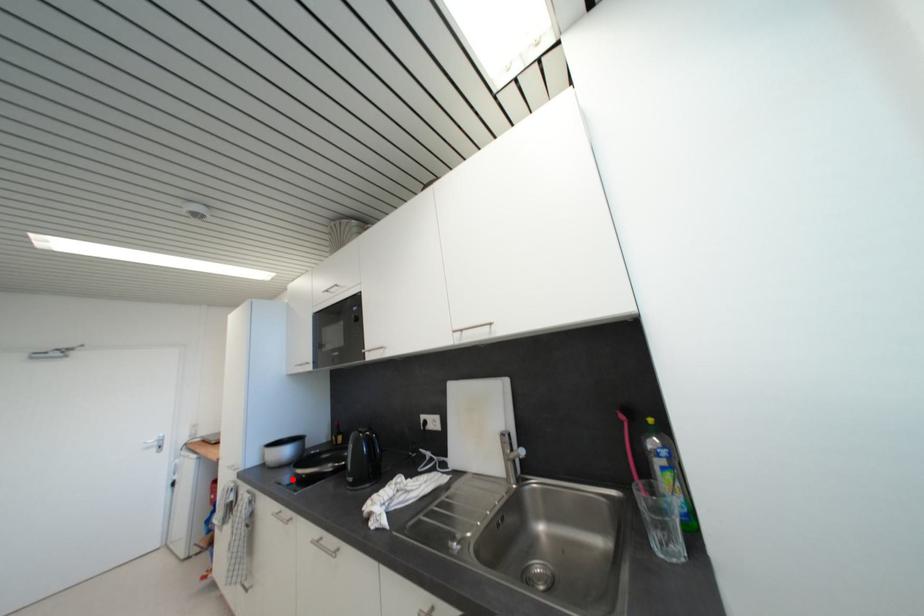
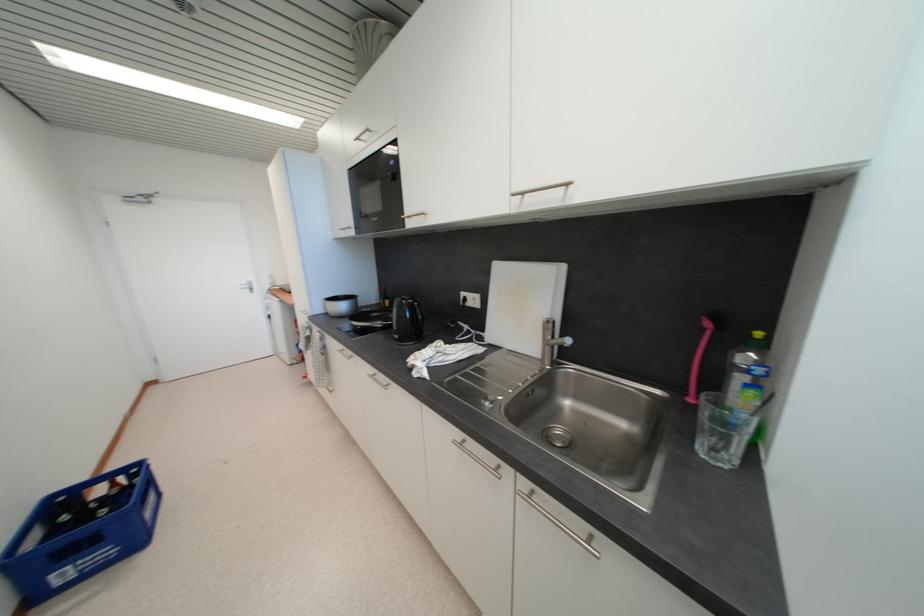
Question: I am providing you with two images of the same scene from different viewpoints. A red point is marked on the first image. Can you still see the location of the red point in image 2?

Choices:
 (A) Yes
 (B) No

Answer: (A)